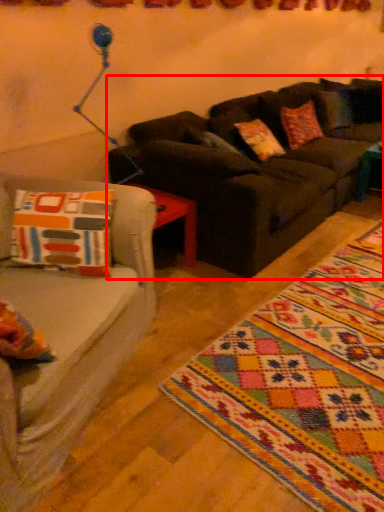
Question: From the image's perspective, where is studio couch (annotated by the red box) located relative to mat?

Choices:
 (A) below
 (B) above

Answer: (B)